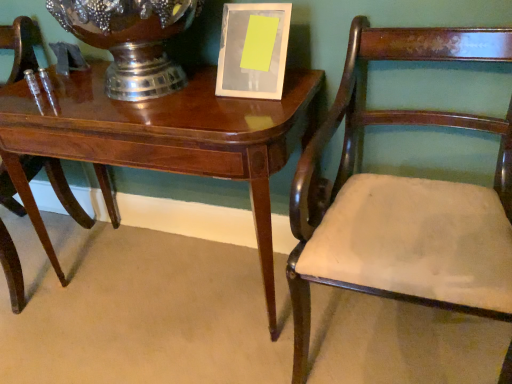
Identify the location of free space that is to the left of white glossy picture frame at upper center. The width and height of the screenshot is (512, 384). (188, 95).